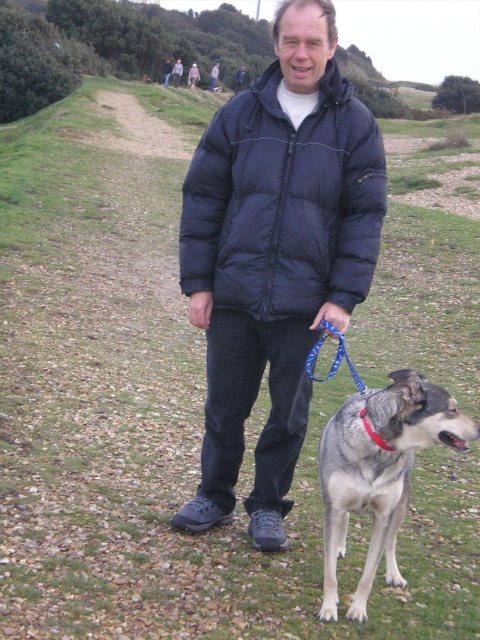
Question: Based on their relative distances, which object is nearer to the navy puffer jacket at center?

Choices:
 (A) dirt/gravel path at center
 (B) blue fabric leash at lower center

Answer: (B)

Question: Can you confirm if dark blue puffy jacket at center is bigger than red fabric neckband at dog right?

Choices:
 (A) no
 (B) yes

Answer: (B)

Question: Does gray fur dog at center have a smaller size compared to blue fabric leash at lower center?

Choices:
 (A) no
 (B) yes

Answer: (A)

Question: Which object is positioned farthest from the blue fabric leash at lower center?

Choices:
 (A) red fabric neckband at dog right
 (B) gray fur dog at center
 (C) navy puffer jacket at center
 (D) dirt/gravel path at center

Answer: (D)

Question: Does gray fur dog at center come behind red fabric neckband at dog right?

Choices:
 (A) yes
 (B) no

Answer: (B)

Question: Which point is closer to the camera taking this photo?

Choices:
 (A) (365, 424)
 (B) (454, 436)
 (C) (231, 289)
 (D) (298, 64)

Answer: (B)